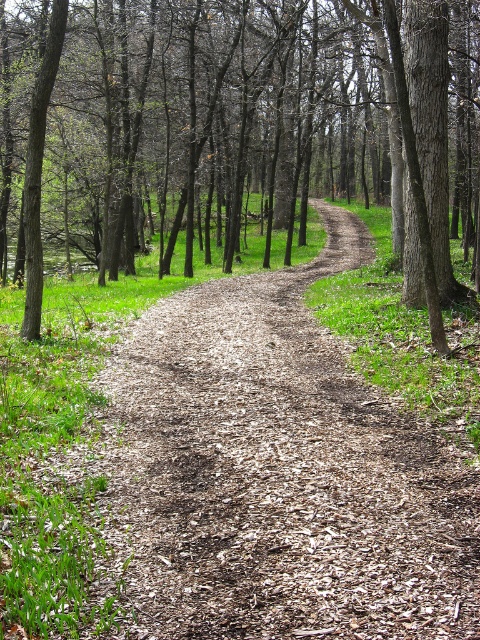
Question: Does brown mulch dirt track at center appear on the left side of brown bark tree at center?

Choices:
 (A) no
 (B) yes

Answer: (A)

Question: Does brown mulch dirt track at center appear over brown bark tree at center?

Choices:
 (A) yes
 (B) no

Answer: (B)

Question: Can you confirm if brown mulch dirt track at center is positioned above brown bark tree at center?

Choices:
 (A) no
 (B) yes

Answer: (A)